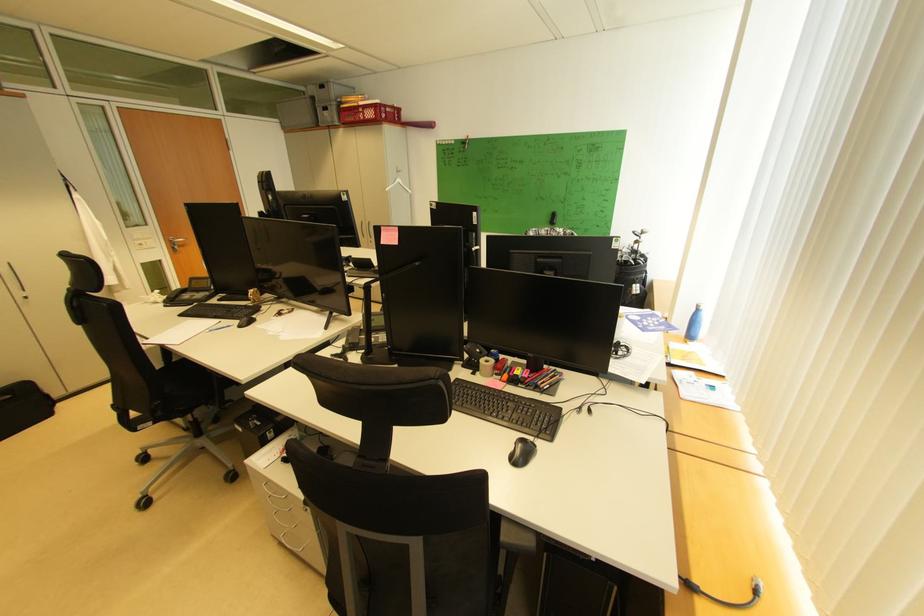
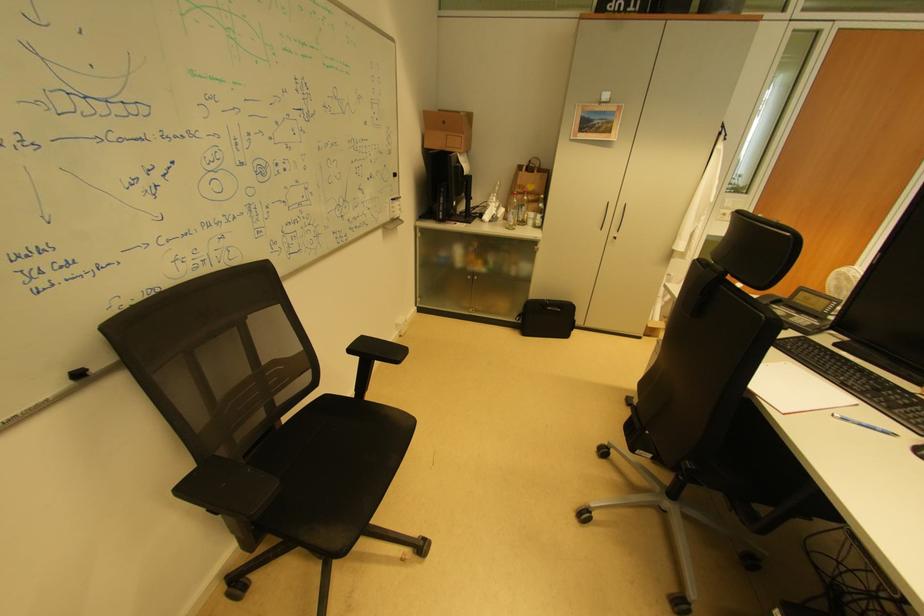
In the second image, find the point that corresponds to point (220, 331) in the first image.

(853, 421)